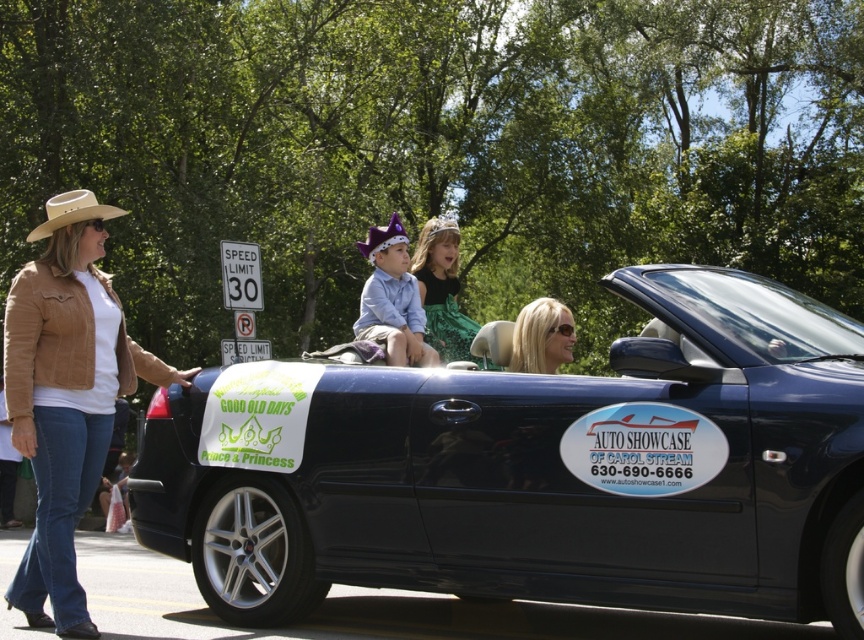
Is point (556, 324) positioned after point (54, 221)?

Yes.

Is point (573, 340) positioned in front of point (71, 221)?

No, it is not.

Does point (532, 337) lie in front of point (100, 211)?

No, it is not.

Locate an element on the screen. blonde hair at center is located at coordinates (542, 337).

Can you confirm if shiny black convertible at center is positioned above blonde hair at center?

Actually, shiny black convertible at center is below blonde hair at center.

Is point (645, 394) behind point (561, 324)?

That is False.

At what (x,y) coordinates should I click in order to perform the action: click on shiny black convertible at center. Please return your answer as a coordinate pair (x, y). The width and height of the screenshot is (864, 640). Looking at the image, I should click on click(537, 468).

Can you confirm if shiny black convertible at center is positioned below tan leather jacket at left?

Yes, shiny black convertible at center is below tan leather jacket at left.

Is shiny black convertible at center smaller than tan leather jacket at left?

No.

I want to click on shiny black convertible at center, so click(x=537, y=468).